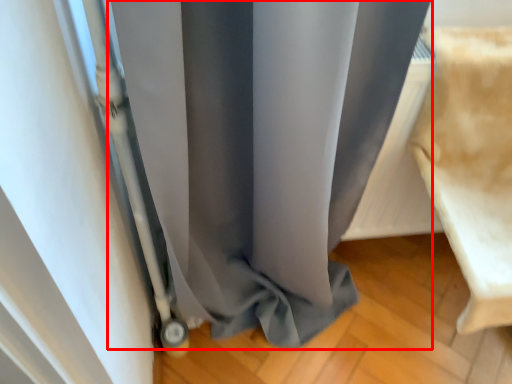
Question: From the image, what is the correct spatial relationship of curtain (annotated by the red box) in relation to furniture?

Choices:
 (A) left
 (B) right

Answer: (A)